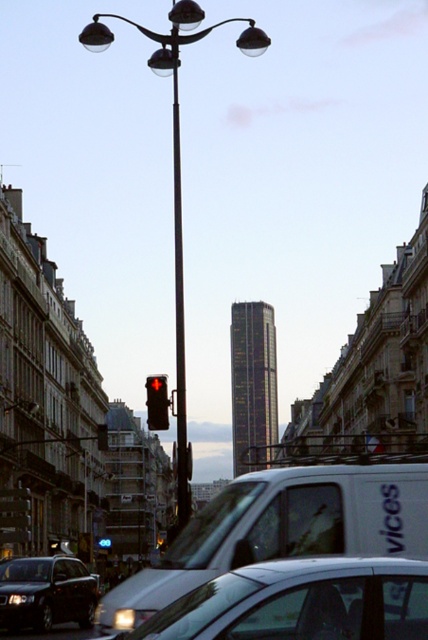
Question: Can you confirm if silver metallic van at center is bigger than metallic pole at center?

Choices:
 (A) yes
 (B) no

Answer: (B)

Question: Which of the following is the closest to the observer?

Choices:
 (A) white matte van at center
 (B) black plastic license plate at center
 (C) silver metallic van at center
 (D) white plastic license plate at center

Answer: (C)

Question: Observing the image, what is the correct spatial positioning of metallic streetlight at center in reference to metallic pole at center?

Choices:
 (A) left
 (B) right

Answer: (B)

Question: Which object appears farthest from the camera in this image?

Choices:
 (A) white matte van at center
 (B) metallic streetlight at center
 (C) silver metallic van at center

Answer: (B)

Question: From the image, what is the correct spatial relationship of red glass traffic light at center in relation to white plastic license plate at center?

Choices:
 (A) right
 (B) left

Answer: (A)

Question: Which object is positioned farthest from the silver metallic van at center?

Choices:
 (A) metallic streetlight at center
 (B) metallic pole at center

Answer: (A)